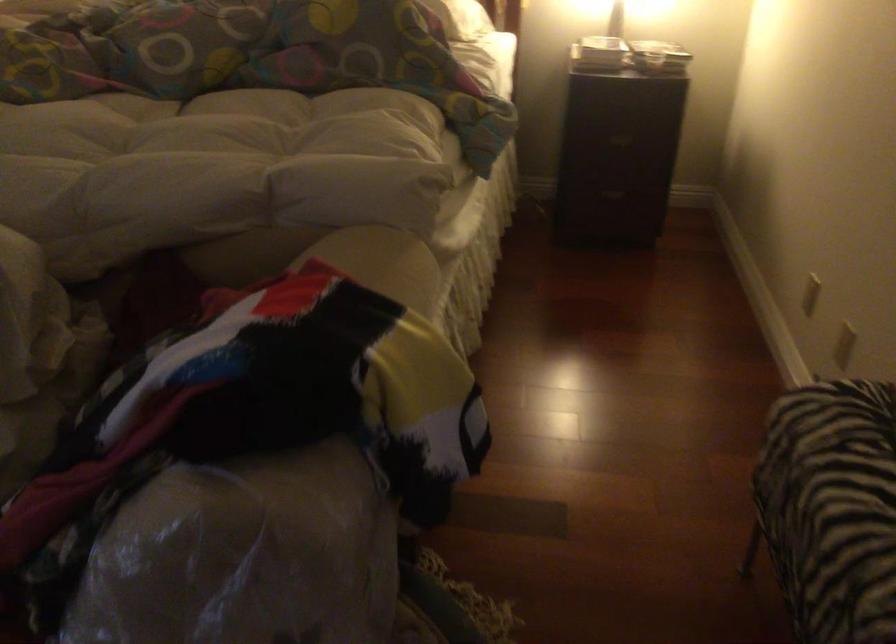
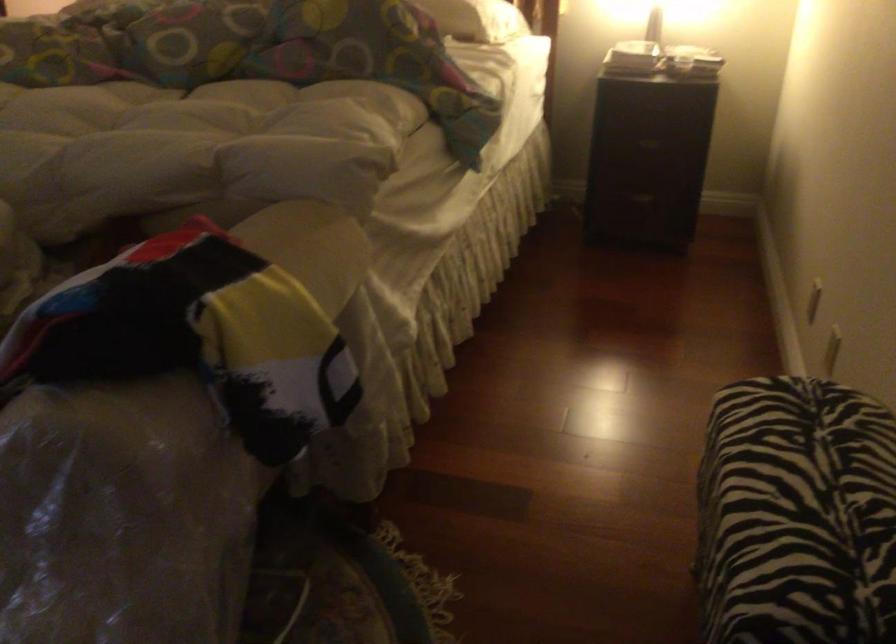
Locate, in the second image, the point that corresponds to [622,136] in the first image.

(650, 140)